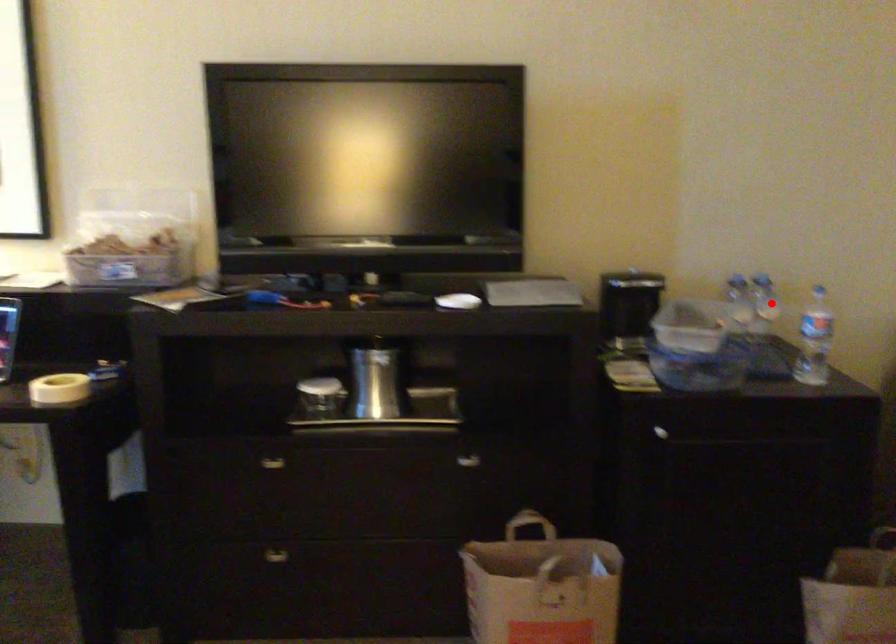
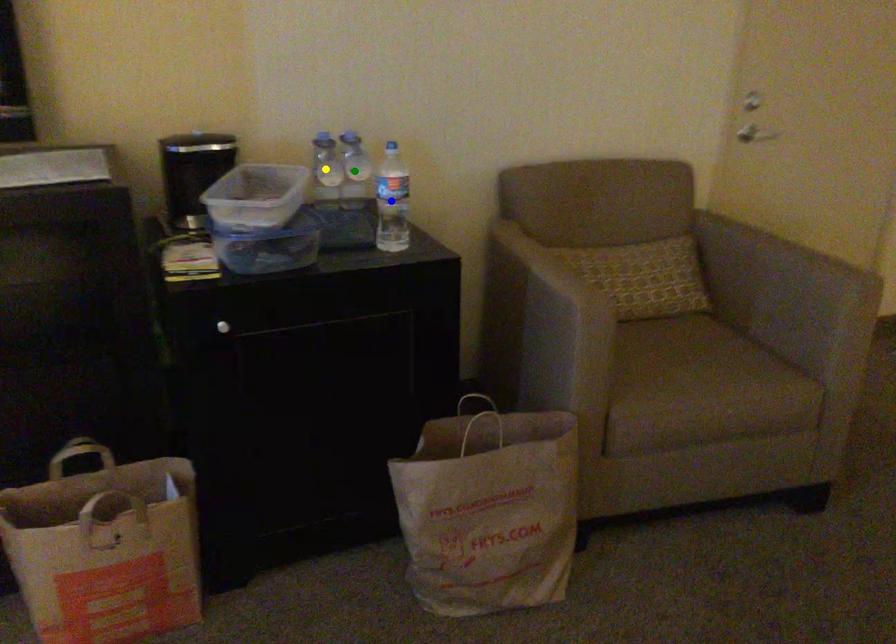
Question: I am providing you with two images of the same scene from different viewpoints. A red point is marked on the first image. You are given multiple points on the second image. Which point in image 2 is actually the same real-world point as the red point in image 1?

Choices:
 (A) blue point
 (B) green point
 (C) yellow point

Answer: (B)